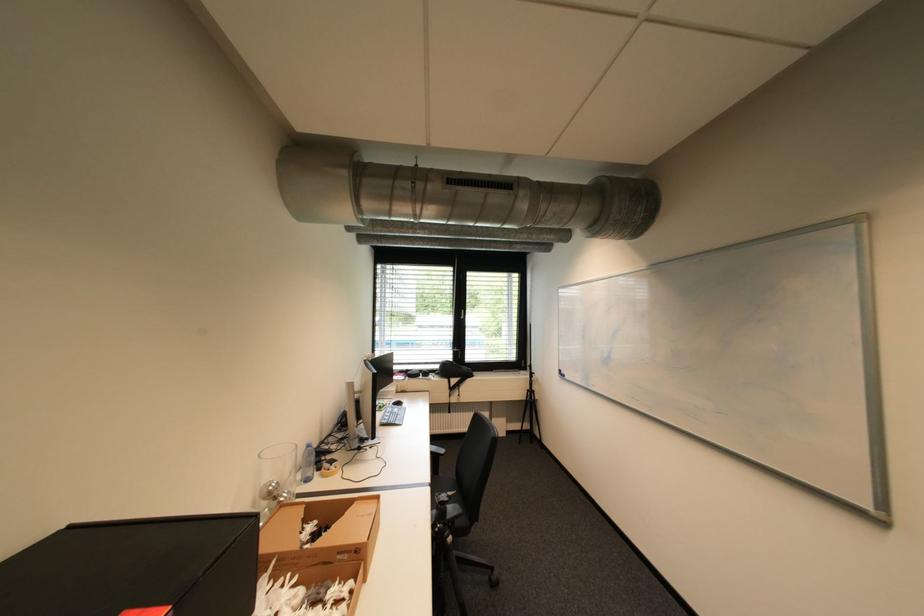
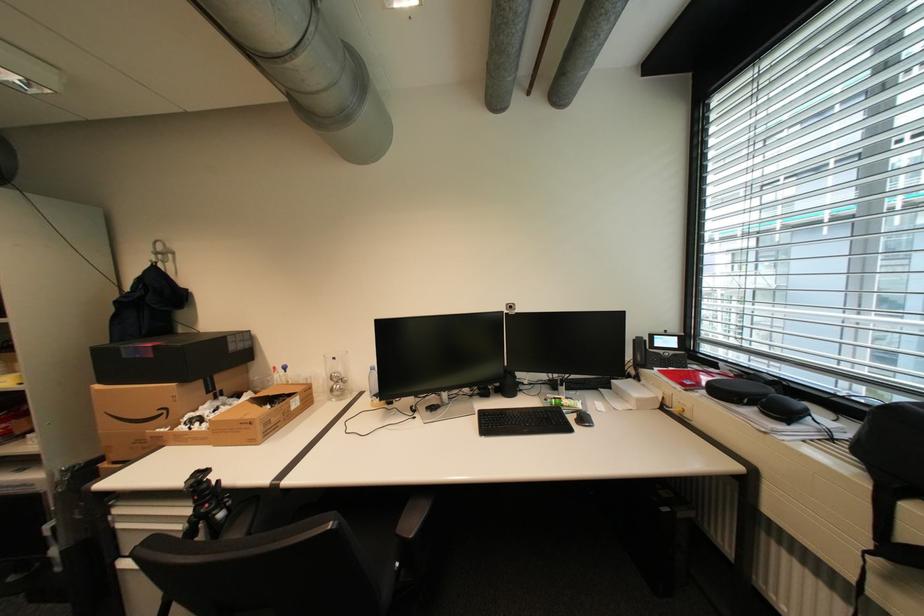
The point at (282, 487) is marked in the first image. Where is the corresponding point in the second image?

(343, 376)